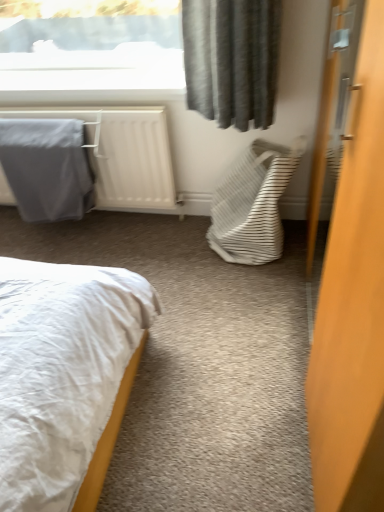
Question: Could you tell me if wooden door at right is turned towards white striped fabric laundry basket at center-right?

Choices:
 (A) yes
 (B) no

Answer: (A)

Question: Is wooden door at right outside of white striped fabric laundry basket at center-right?

Choices:
 (A) yes
 (B) no

Answer: (A)

Question: Does wooden door at right have a greater height compared to white striped fabric laundry basket at center-right?

Choices:
 (A) no
 (B) yes

Answer: (B)

Question: Is wooden door at right with white striped fabric laundry basket at center-right?

Choices:
 (A) no
 (B) yes

Answer: (A)

Question: Is wooden door at right to the left of white striped fabric laundry basket at center-right from the viewer's perspective?

Choices:
 (A) yes
 (B) no

Answer: (B)

Question: From the image's perspective, does wooden door at right appear higher than white striped fabric laundry basket at center-right?

Choices:
 (A) yes
 (B) no

Answer: (B)

Question: Does gray fabric at left appear on the right side of gray fabric blanket at left?

Choices:
 (A) no
 (B) yes

Answer: (A)

Question: Does gray fabric at left touch gray fabric blanket at left?

Choices:
 (A) yes
 (B) no

Answer: (B)

Question: From a real-world perspective, is gray fabric at left physically above gray fabric blanket at left?

Choices:
 (A) yes
 (B) no

Answer: (A)

Question: From a real-world perspective, is gray fabric at left physically below gray fabric blanket at left?

Choices:
 (A) no
 (B) yes

Answer: (A)

Question: Is gray fabric at left bigger than gray fabric blanket at left?

Choices:
 (A) yes
 (B) no

Answer: (A)

Question: From the image's perspective, is gray fabric at left under gray fabric blanket at left?

Choices:
 (A) yes
 (B) no

Answer: (B)

Question: From the image's perspective, would you say gray fabric blanket at left is shown under white striped fabric laundry basket at center-right?

Choices:
 (A) no
 (B) yes

Answer: (A)